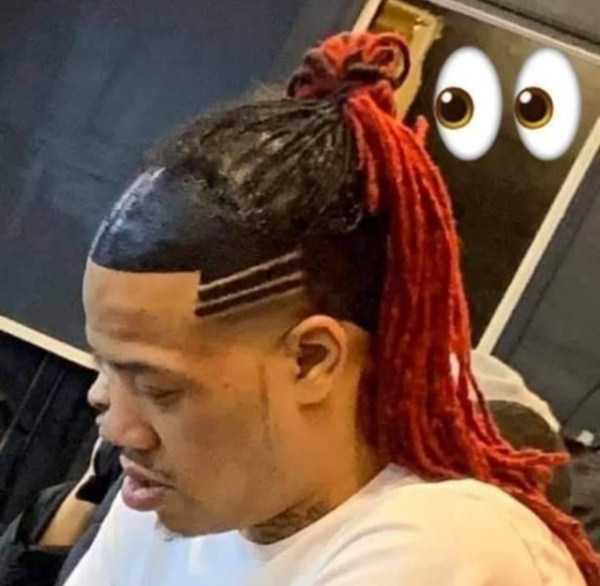
This screenshot has height=586, width=600. I want to click on towel, so click(x=539, y=395).